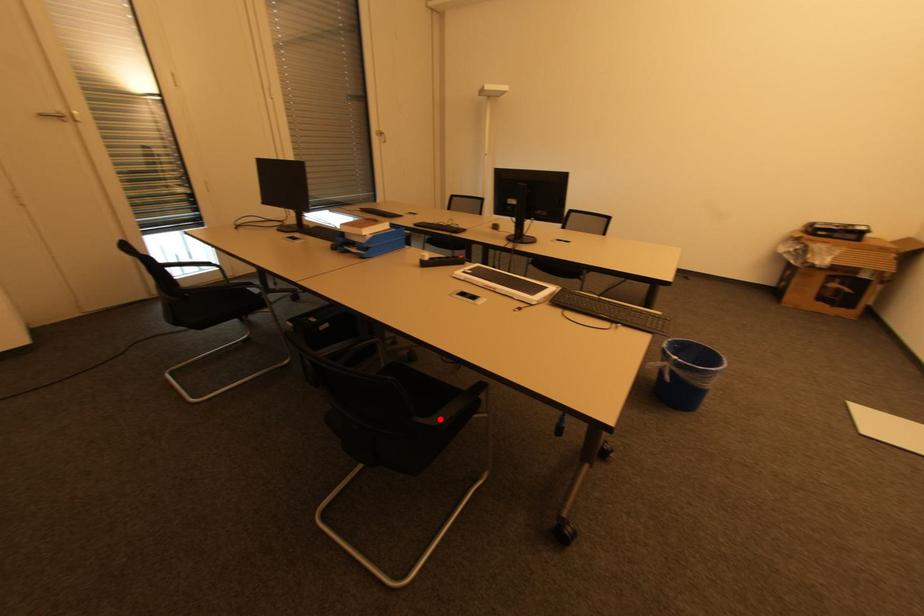
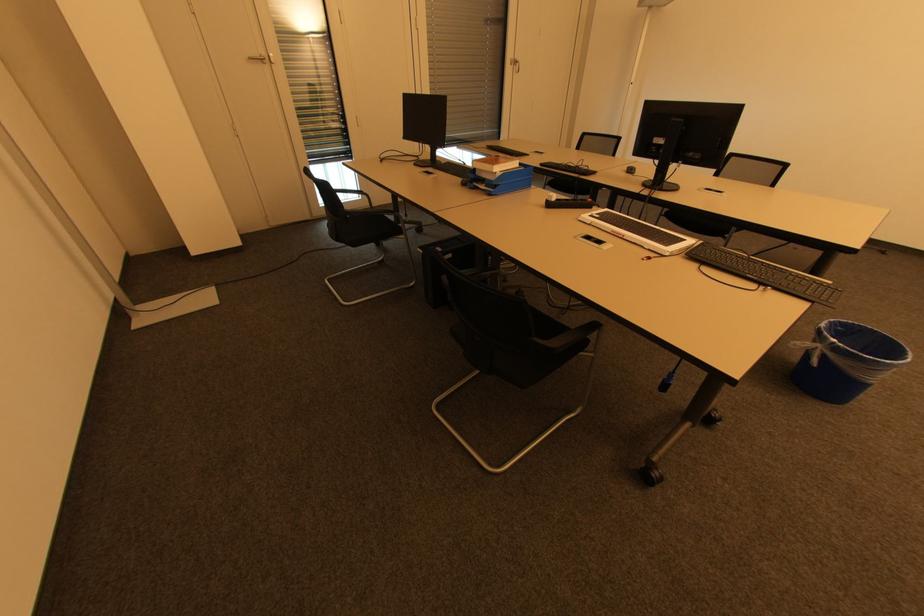
Locate, in the second image, the point that corresponds to the highlighted location in the first image.

(556, 344)